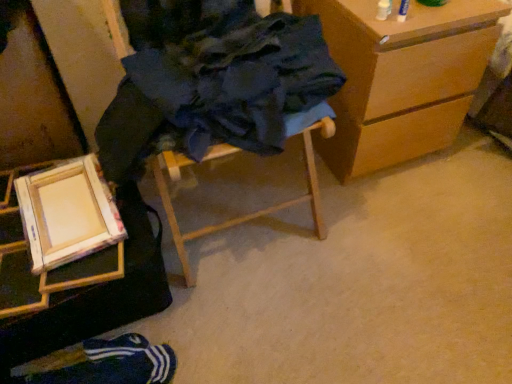
Question: Is wooden folding chair at center, the first furniture from the right, taller or shorter than wooden frame at lower left?

Choices:
 (A) short
 (B) tall

Answer: (B)

Question: From a real-world perspective, is wooden folding chair at center, the first furniture from the right, physically located above or below wooden frame at lower left?

Choices:
 (A) above
 (B) below

Answer: (A)

Question: Which is farther from the wooden folding chair at center, the first furniture from the right?

Choices:
 (A) blue fabric socks at lower left
 (B) wooden easel at lower left, the first furniture viewed from the left
 (C) wooden frame at lower left
 (D) wooden chest of drawers at right

Answer: (A)

Question: Estimate the real-world distances between objects in this image. Which object is closer to the wooden chest of drawers at right?

Choices:
 (A) wooden frame at lower left
 (B) wooden easel at lower left, the first furniture viewed from the left
 (C) blue fabric socks at lower left
 (D) wooden folding chair at center, positioned as the second furniture in left-to-right order

Answer: (D)